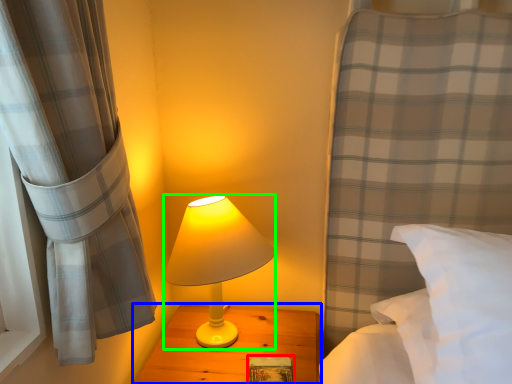
Question: Which is nearer to the book (highlighted by a red box)? nightstand (highlighted by a blue box) or lamp (highlighted by a green box).

Choices:
 (A) nightstand
 (B) lamp

Answer: (A)